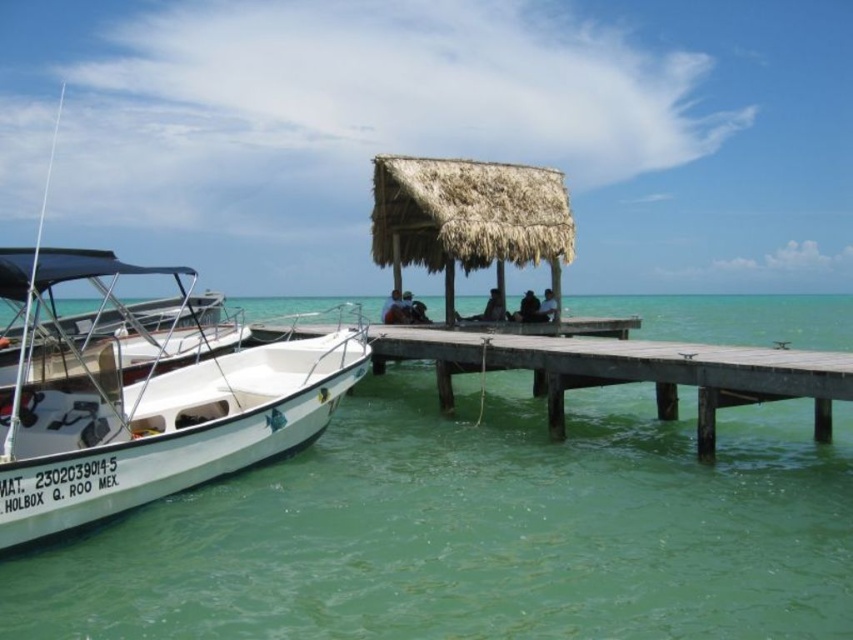
Question: Which object is the closest to the thatched straw hut at center?

Choices:
 (A) white matte boat at left
 (B) dark gray fabric shirt at center
 (C) white fabric shirt at center

Answer: (C)

Question: Among these points, which one is nearest to the camera?

Choices:
 (A) [799, 308]
 (B) [517, 189]

Answer: (B)

Question: Can you confirm if wooden dock at center is positioned to the left of smooth tan skin at center?

Choices:
 (A) yes
 (B) no

Answer: (B)

Question: In this image, where is white matte boat at left located relative to dark brown hair at center?

Choices:
 (A) above
 (B) below

Answer: (A)

Question: Which of the following is the closest to the observer?

Choices:
 (A) (543, 292)
 (B) (320, 449)
 (C) (808, 371)

Answer: (C)

Question: Is green translucent water at lower left behind wooden dock at center?

Choices:
 (A) no
 (B) yes

Answer: (A)